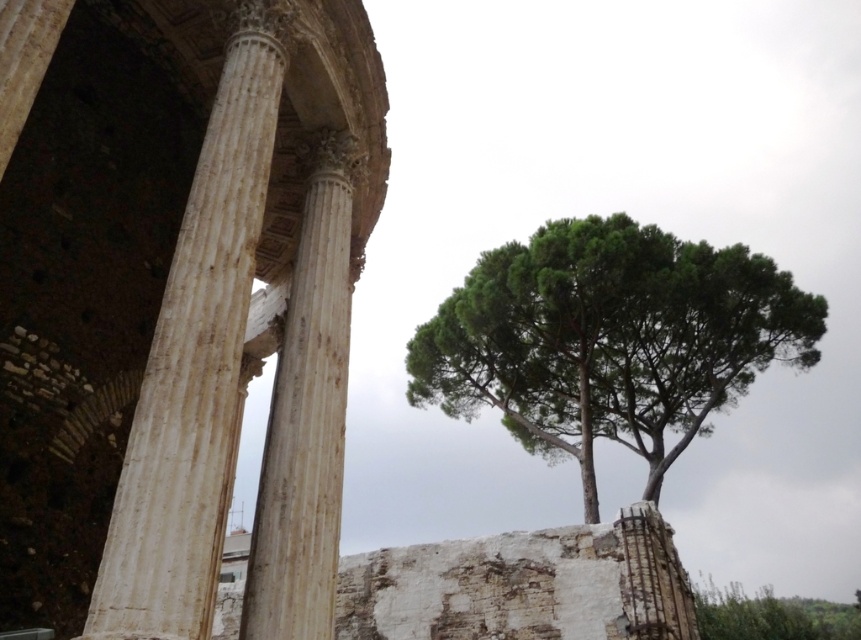
Based on the coordinates provided, where is the green leafy tree at upper right located in the image?

The green leafy tree at upper right is located at the 2D coordinates point (609, 339) in the image.

You are standing in the ancient ruins and want to walk from the point at coordinates point (478, 292) to the point at coordinates point (331, 596). Which direction should you face to move towards the second point?

To move from point (478, 292) to point (331, 596), you should face towards the right and slightly downward since point (331, 596) is located to the right and lower in the image compared to point (478, 292).

You are standing at the point marked by the coordinates point (609, 339) in the image. You want to move towards the columns on the left. Which direction should you face to walk directly towards the columns?

The point (609, 339) is the green leafy tree at upper right. To move towards the columns on the left, you should face left.